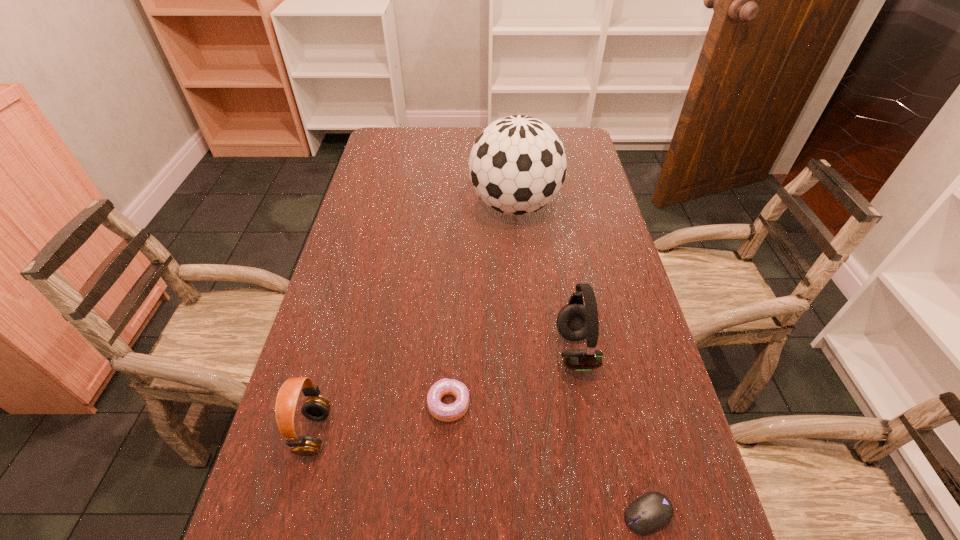
Locate an element on the screen. The height and width of the screenshot is (540, 960). free spot located on the ear cups of the farther headset is located at coordinates (418, 350).

Locate an element on the screen. blank space located 0.310m on the ear cups of the farther headset is located at coordinates (421, 350).

Locate an element on the screen. vacant space located on the ear cups of the farther headset is located at coordinates (474, 350).

This screenshot has width=960, height=540. I want to click on vacant space situated on the ear cups of the nearer headset, so click(394, 433).

Locate an element on the screen. This screenshot has height=540, width=960. vacant space located 0.190m on the front of the doughnut is located at coordinates (442, 529).

The width and height of the screenshot is (960, 540). Identify the location of vacant space located on the left of the shortest object. (442, 514).

You are a GUI agent. You are given a task and a screenshot of the screen. Output one action in this format:
    pyautogui.click(x=<x>, y=<y>)
    Task: Click on the object at the left edge
    Image resolution: width=960 pixels, height=540 pixels.
    Given the screenshot: What is the action you would take?
    pyautogui.click(x=316, y=407)

You are a GUI agent. You are given a task and a screenshot of the screen. Output one action in this format:
    pyautogui.click(x=<x>, y=<y>)
    Task: Click on the soccer ball that is at the right edge
    
    Given the screenshot: What is the action you would take?
    pyautogui.click(x=517, y=165)

Identify the location of headset at the right edge. (575, 321).

Where is `computer mouse located in the right edge section of the desktop`? The image size is (960, 540). computer mouse located in the right edge section of the desktop is located at coordinates point(653,510).